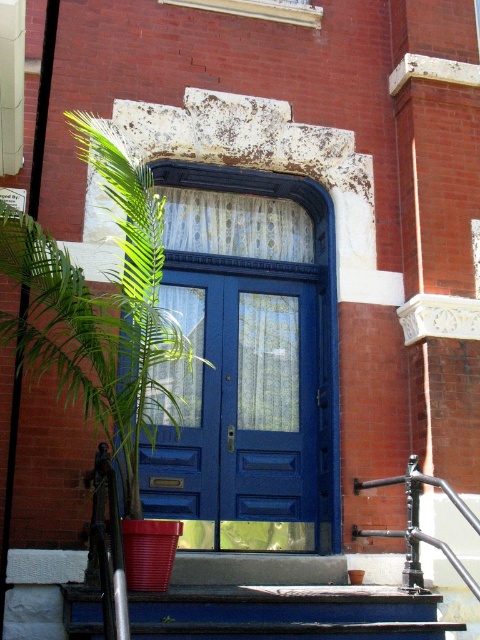
Question: Can you confirm if blue glossy door at center is positioned to the right of smooth blue stairs at center?

Choices:
 (A) no
 (B) yes

Answer: (A)

Question: Considering the relative positions of blue glossy door at center and green leafy plant at left in the image provided, where is blue glossy door at center located with respect to green leafy plant at left?

Choices:
 (A) above
 (B) below

Answer: (B)

Question: Which object is positioned farthest from the smooth blue stairs at center?

Choices:
 (A) green leafy plant at left
 (B) blue glossy door at center

Answer: (A)

Question: Which of the following is the farthest from the observer?

Choices:
 (A) (462, 624)
 (B) (103, 403)
 (C) (182, 547)

Answer: (C)

Question: Which point is farther to the camera?

Choices:
 (A) smooth blue stairs at center
 (B) green leafy plant at left
 (C) blue glossy door at center

Answer: (C)

Question: Is blue glossy door at center thinner than smooth blue stairs at center?

Choices:
 (A) no
 (B) yes

Answer: (B)